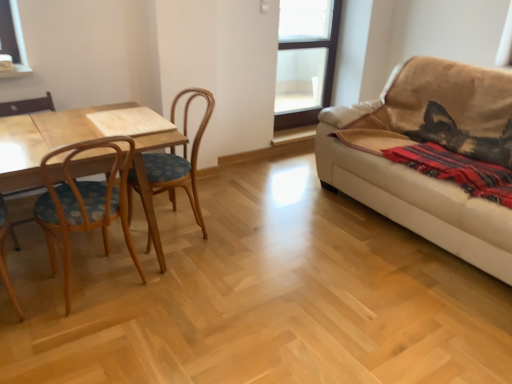
Locate an element on the screen. Image resolution: width=512 pixels, height=384 pixels. vacant point to the right of wooden table at left is located at coordinates (236, 266).